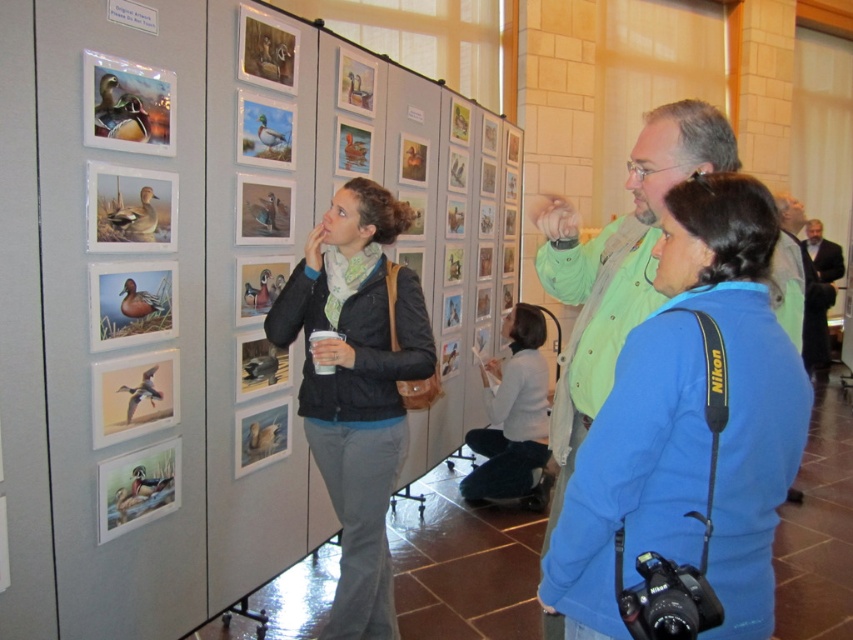
Is point (521, 468) behind point (810, 326)?

No, it is not.

Is point (534, 348) positioned before point (811, 244)?

That is True.

Where is `white matte jacket at center`? white matte jacket at center is located at coordinates (512, 413).

Is blue fabric jacket at center positioned at the back of black matte jacket at center?

No.

Measure the distance between point (x=747, y=605) and camera.

1.17 meters

Between point (698, 186) and point (279, 330), which one is positioned in front?

Point (698, 186)

I want to click on blue fabric jacket at center, so click(689, 424).

Can you confirm if blue fabric jacket at center is smaller than white matte jacket at center?

Yes.

Which is in front, point (705, 468) or point (512, 492)?

Point (705, 468) is in front.

I want to click on blue fabric jacket at center, so click(689, 424).